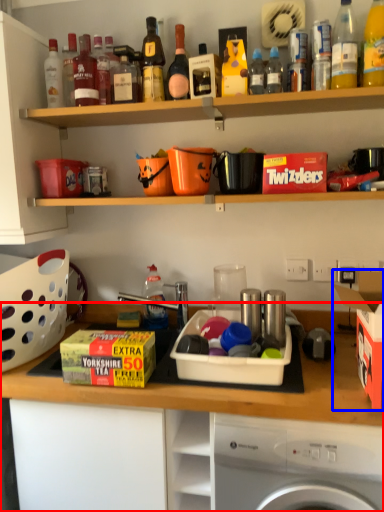
Question: Which object is closer to the camera taking this photo, cabinetry (highlighted by a red box) or cardboard box (highlighted by a blue box)?

Choices:
 (A) cabinetry
 (B) cardboard box

Answer: (B)